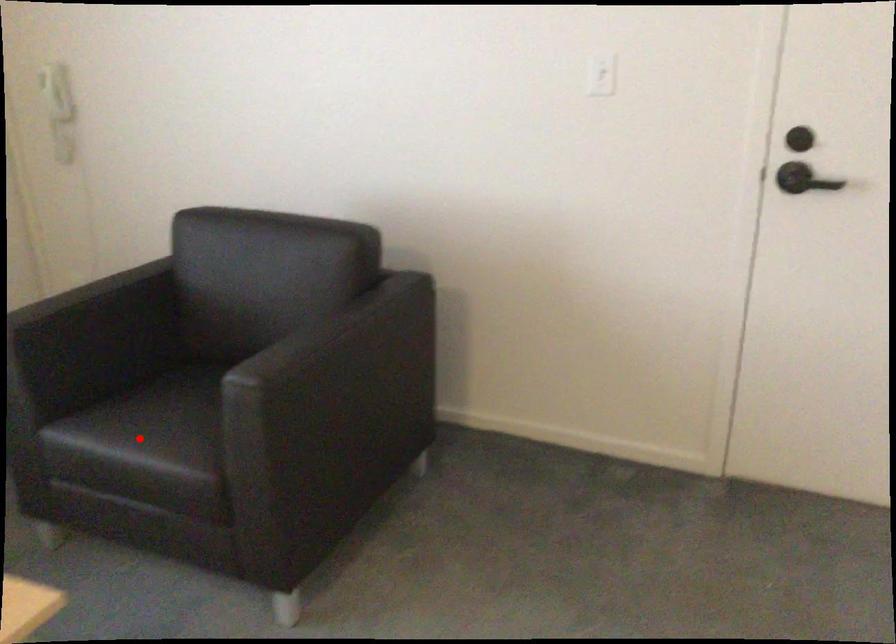
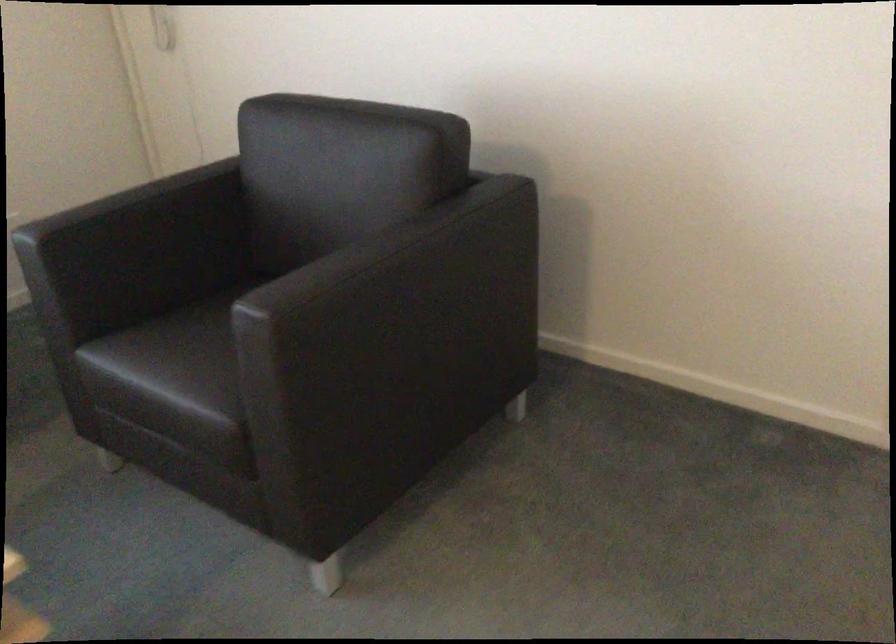
Locate, in the second image, the point that corresponds to the highlighted location in the first image.

(168, 366)